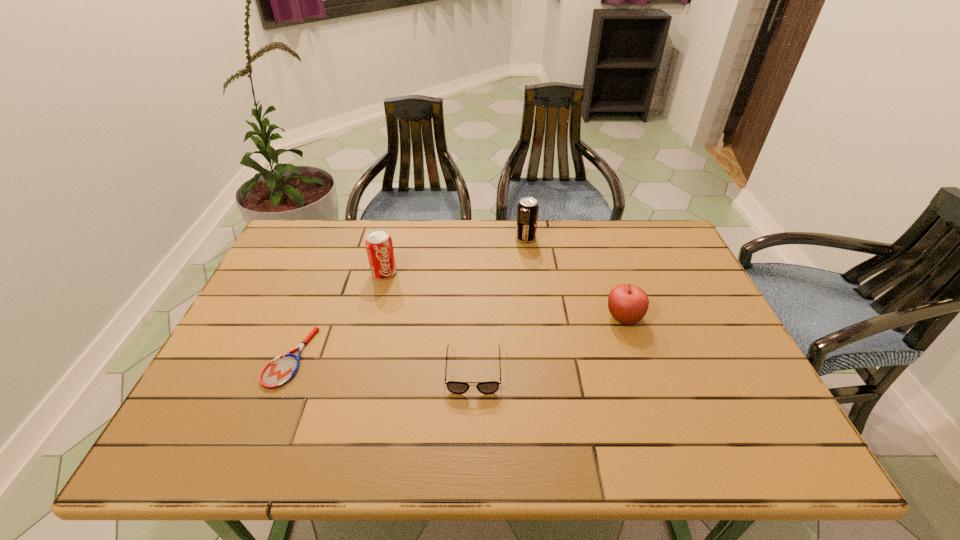
Where is `the right soda can`? This screenshot has width=960, height=540. the right soda can is located at coordinates (527, 209).

What are the coordinates of `the farther soda can` in the screenshot? It's located at (527, 209).

At what (x,y) coordinates should I click in order to perform the action: click on the second farthest object. Please return your answer as a coordinate pair (x, y). Looking at the image, I should click on (379, 246).

At what (x,y) coordinates should I click in order to perform the action: click on the nearer soda can. Please return your answer as a coordinate pair (x, y). The width and height of the screenshot is (960, 540). Looking at the image, I should click on (379, 246).

At what (x,y) coordinates should I click in order to perform the action: click on apple. Please return your answer as a coordinate pair (x, y). Image resolution: width=960 pixels, height=540 pixels. Looking at the image, I should click on (628, 304).

Locate an element on the screen. the third shortest object is located at coordinates (628, 304).

Identify the location of the second shortest object. The image size is (960, 540). (454, 387).

In order to click on spectacles in this screenshot , I will do `click(454, 387)`.

Locate an element on the screen. Image resolution: width=960 pixels, height=540 pixels. the leftmost object is located at coordinates (278, 372).

Find the location of `the shortest object`. the shortest object is located at coordinates (278, 372).